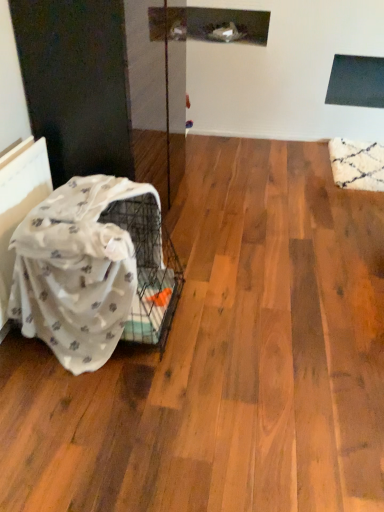
What do you see at coordinates (76, 271) in the screenshot? This screenshot has width=384, height=512. I see `white fleece blanket at left` at bounding box center [76, 271].

What is the approximate width of white fleece blanket at left?

22.54 inches.

Locate an element on the screen. white fleece blanket at left is located at coordinates (76, 271).

Image resolution: width=384 pixels, height=512 pixels. What are the coordinates of `white fleece blanket at left` in the screenshot? It's located at (76, 271).